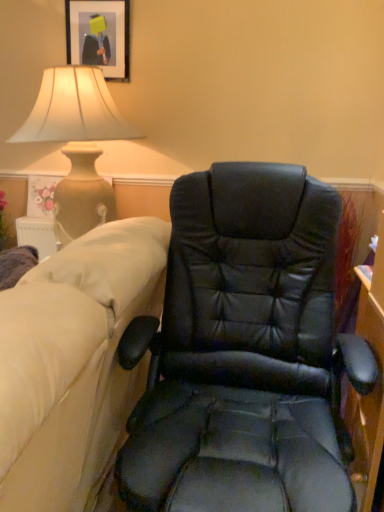
Question: Is matte black picture frame at upper left inside the boundaries of black leather chair at center, or outside?

Choices:
 (A) inside
 (B) outside

Answer: (B)

Question: From a real-world perspective, is matte black picture frame at upper left positioned above or below black leather chair at center?

Choices:
 (A) above
 (B) below

Answer: (A)

Question: Relative to black leather chair at center, is matte black picture frame at upper left in front or behind?

Choices:
 (A) front
 (B) behind

Answer: (B)

Question: Is black leather chair at center taller or shorter than matte black picture frame at upper left?

Choices:
 (A) tall
 (B) short

Answer: (A)

Question: Considering their positions, is black leather chair at center located in front of or behind matte black picture frame at upper left?

Choices:
 (A) front
 (B) behind

Answer: (A)

Question: Based on their sizes in the image, would you say black leather chair at center is bigger or smaller than matte black picture frame at upper left?

Choices:
 (A) big
 (B) small

Answer: (A)

Question: Does point coord(165,503) appear closer or farther from the camera than point coord(92,46)?

Choices:
 (A) farther
 (B) closer

Answer: (B)